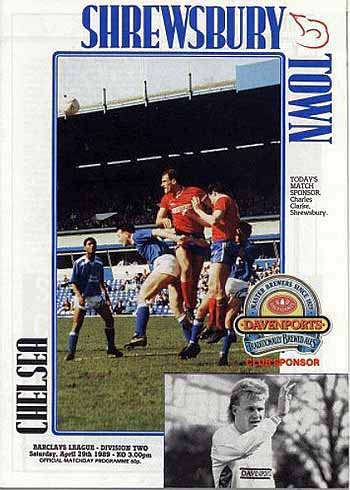
At what (x,y) coordinates should I click in order to perform the action: click on red sock. Please return your answer as a coordinate pair (x, y). Looking at the image, I should click on (188, 290), (194, 292), (208, 316), (220, 304).